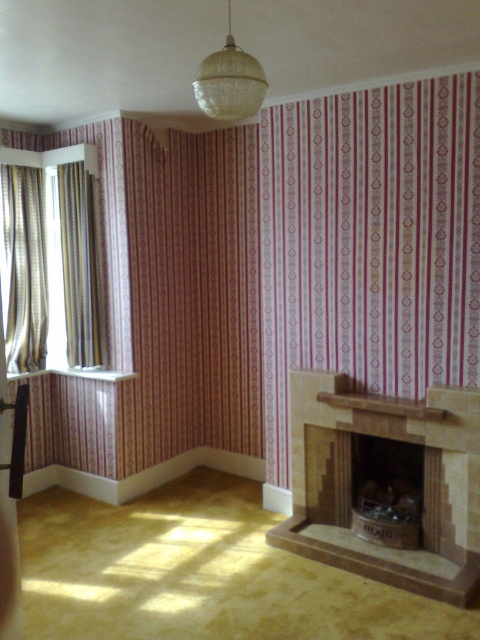
Between brown stone fireplace at lower right and translucent glass chandelier at upper center, which one is positioned higher?

translucent glass chandelier at upper center is above.

Is brown stone fireplace at lower right thinner than translucent glass chandelier at upper center?

In fact, brown stone fireplace at lower right might be wider than translucent glass chandelier at upper center.

Which is behind, point (456, 396) or point (255, 72)?

The point (456, 396) is more distant.

Where is `brown stone fireplace at lower right`? The image size is (480, 640). brown stone fireplace at lower right is located at coordinates (397, 458).

Who is positioned more to the left, silky gold curtains at left or translucent glass chandelier at upper center?

silky gold curtains at left

Who is shorter, silky gold curtains at left or translucent glass chandelier at upper center?

Standing shorter between the two is translucent glass chandelier at upper center.

I want to click on silky gold curtains at left, so click(x=24, y=268).

Where is `silky gold curtains at left`? The image size is (480, 640). silky gold curtains at left is located at coordinates (x=24, y=268).

Does brown stone fireplace at lower right have a smaller size compared to silky gold curtains at left?

Actually, brown stone fireplace at lower right might be larger than silky gold curtains at left.

Does brown stone fireplace at lower right lie in front of silky gold curtains at left?

That is True.

Identify the location of brown stone fireplace at lower right. The width and height of the screenshot is (480, 640). (397, 458).